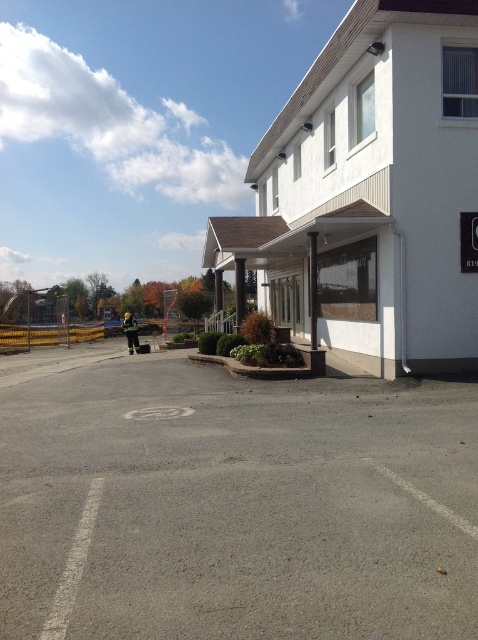
Question: Does gray asphalt parking lot at center have a smaller size compared to white smooth building at center?

Choices:
 (A) no
 (B) yes

Answer: (B)

Question: Does gray asphalt parking lot at center lie behind white smooth building at center?

Choices:
 (A) yes
 (B) no

Answer: (B)

Question: Which of the following is the closest to the observer?

Choices:
 (A) white smooth building at center
 (B) gray asphalt parking lot at center

Answer: (B)

Question: Which point appears closest to the camera in this image?

Choices:
 (A) (417, 564)
 (B) (398, 228)

Answer: (A)

Question: Observing the image, what is the correct spatial positioning of gray asphalt parking lot at center in reference to white smooth building at center?

Choices:
 (A) below
 (B) above

Answer: (A)